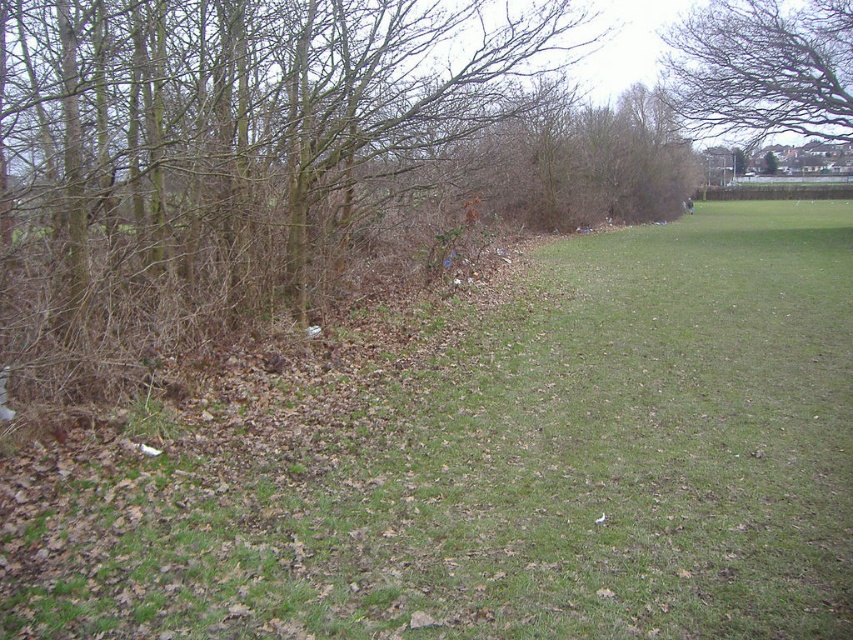
Which is in front, point (368, 429) or point (796, 124)?

Point (368, 429) is more forward.

From the picture: Is green grassy at left in front of bare branches at upper center?

Yes, it is in front of bare branches at upper center.

Where is `green grassy at left`? Image resolution: width=853 pixels, height=640 pixels. green grassy at left is located at coordinates (486, 460).